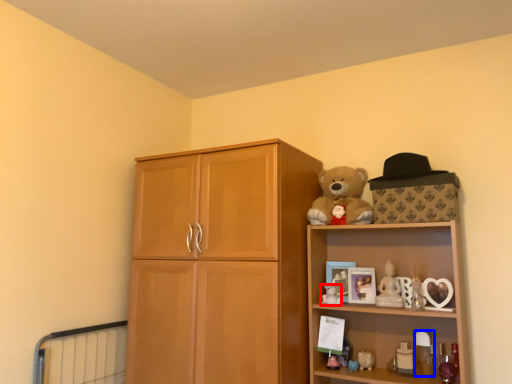
Question: Which object is closer to the camera taking this photo, toy (highlighted by a red box) or toy (highlighted by a blue box)?

Choices:
 (A) toy
 (B) toy

Answer: (B)